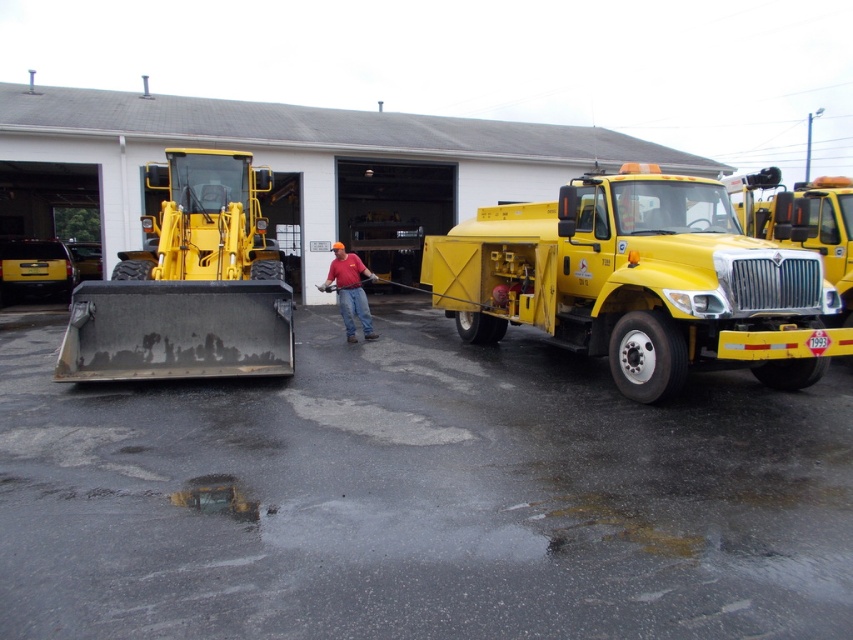
Based on the photo, you are a delivery driver who needs to park your 2.5 meter wide truck between the yellow matte truck at center and the matte black forklift at left. Based on the scene, can your truck fit in the space between them?

The yellow matte truck at center is wider than the matte black forklift at left. Since the space between them must accommodate your 2.5 meter wide truck, but the exact width isn

Consider the image. You are a delivery person trying to navigate through the workshop area. There is a yellow matte truck at center and a matte black forklift at left. Which vehicle should you avoid walking behind to prevent being blocked from view by the other?

You should avoid walking behind the yellow matte truck at center because it is in front of the matte black forklift at left, so standing behind it would block your view of the forklift and vice versa.

You are a delivery person who needs to unload a package that requires a forklift. You see the yellow matte truck at center and the matte black forklift at left. Which one should you use to move the package?

The matte black forklift at left should be used to move the package since it is designed for lifting and transporting heavy items, while the yellow matte truck at center is likely for transporting goods.